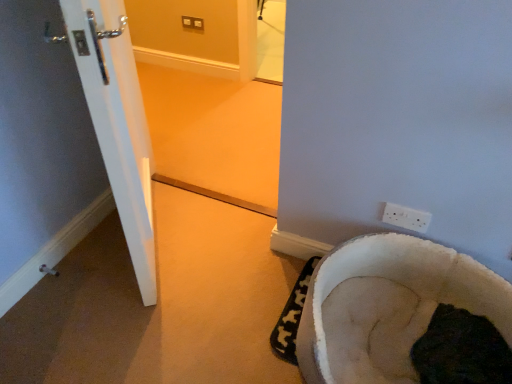
Describe the element at coordinates (388, 306) in the screenshot. I see `white fluffy pet bed at lower right` at that location.

Find the location of a particular element. white fluffy pet bed at lower right is located at coordinates (388, 306).

Measure the distance between dark fur bed at lower right and camera.

dark fur bed at lower right is 1.24 meters away from camera.

Where is `white fluffy pet bed at lower right`? white fluffy pet bed at lower right is located at coordinates (388, 306).

Does white plastic electric outlet at lower right have a lesser width compared to white fluffy pet bed at lower right?

Indeed, white plastic electric outlet at lower right has a lesser width compared to white fluffy pet bed at lower right.

Does white plastic electric outlet at lower right touch white fluffy pet bed at lower right?

There is a gap between white plastic electric outlet at lower right and white fluffy pet bed at lower right.

Who is shorter, white plastic electric outlet at lower right or white fluffy pet bed at lower right?

white fluffy pet bed at lower right is shorter.

Considering the sizes of objects white fluffy pet bed at lower right and white plastic electric outlet at lower right in the image provided, who is wider, white fluffy pet bed at lower right or white plastic electric outlet at lower right?

With larger width is white fluffy pet bed at lower right.

Does point (341, 321) appear closer or farther from the camera than point (402, 217)?

Point (341, 321) appears to be closer to the viewer than point (402, 217).

Where is `furniture below the white plastic electric outlet at lower right (from a real-world perspective)`? furniture below the white plastic electric outlet at lower right (from a real-world perspective) is located at coordinates (388, 306).

Can you tell me how much white fluffy pet bed at lower right and white plastic electric outlet at lower right differ in facing direction?

The angular difference between white fluffy pet bed at lower right and white plastic electric outlet at lower right is 179 degrees.

Which is behind, dark fur bed at lower right or white glossy door at lower left?

Positioned behind is white glossy door at lower left.

Looking at this image, is dark fur bed at lower right far from white glossy door at lower left?

Indeed, dark fur bed at lower right is not near white glossy door at lower left.

Between point (473, 351) and point (27, 274), which one is positioned in front?

The point (473, 351) is more forward.

From the picture: Considering the sizes of white fluffy pet bed at lower right and white glossy door at lower left in the image, is white fluffy pet bed at lower right wider or thinner than white glossy door at lower left?

Considering their sizes, white fluffy pet bed at lower right looks slimmer than white glossy door at lower left.

Find the location of a particular element. This screenshot has height=384, width=512. furniture above the white glossy door at lower left (from a real-world perspective) is located at coordinates point(388,306).

Do you think white fluffy pet bed at lower right is within white glossy door at lower left, or outside of it?

white fluffy pet bed at lower right is not inside white glossy door at lower left, it's outside.

How different are the orientations of white fluffy pet bed at lower right and white glossy door at lower left in degrees?

0.1 degrees.

Are white glossy door at lower left and white fluffy pet bed at lower right beside each other?

No, white glossy door at lower left is not touching white fluffy pet bed at lower right.

Is white glossy door at lower left oriented towards white fluffy pet bed at lower right?

No, white glossy door at lower left is not oriented towards white fluffy pet bed at lower right.

From the picture: From the image's perspective, is white glossy door at lower left located above or below white fluffy pet bed at lower right?

From the image's perspective, white glossy door at lower left appears above white fluffy pet bed at lower right.

In terms of width, does white glossy door at lower left look wider or thinner when compared to white fluffy pet bed at lower right?

Considering their sizes, white glossy door at lower left looks broader than white fluffy pet bed at lower right.

Could you tell me if dark fur bed at lower right is facing white fluffy pet bed at lower right?

No, dark fur bed at lower right is not facing towards white fluffy pet bed at lower right.

Considering the relative sizes of dark fur bed at lower right and white fluffy pet bed at lower right in the image provided, is dark fur bed at lower right thinner than white fluffy pet bed at lower right?

Yes.

From the image's perspective, which is above, dark fur bed at lower right or white fluffy pet bed at lower right?

white fluffy pet bed at lower right appears higher in the image.

What's the angular difference between white glossy door at lower left and white plastic electric outlet at lower right's facing directions?

The facing directions of white glossy door at lower left and white plastic electric outlet at lower right are 180 degrees apart.

From the image's perspective, relative to white plastic electric outlet at lower right, is white glossy door at lower left above or below?

Clearly, from the image's perspective, white glossy door at lower left is above white plastic electric outlet at lower right.

Is white glossy door at lower left in front of white plastic electric outlet at lower right?

No, white glossy door at lower left is further to the viewer.

Locate an element on the screen. electric outlet above the white fluffy pet bed at lower right (from a real-world perspective) is located at coordinates (406, 217).

Find the location of a particular element. The width and height of the screenshot is (512, 384). electric outlet lying above the white fluffy pet bed at lower right (from the image's perspective) is located at coordinates (406, 217).

Looking at the image, which one is located further to white plastic electric outlet at lower right, white glossy door at lower left or white fluffy pet bed at lower right?

white glossy door at lower left is positioned further to the anchor white plastic electric outlet at lower right.

When comparing their distances from white plastic electric outlet at lower right, does white fluffy pet bed at lower right or white glossy door at lower left seem further?

Among the two, white glossy door at lower left is located further to white plastic electric outlet at lower right.

Considering their positions, is white plastic electric outlet at lower right positioned closer to dark fur bed at lower right than white fluffy pet bed at lower right?

Based on the image, white fluffy pet bed at lower right appears to be nearer to dark fur bed at lower right.

Which object lies further to the anchor point white glossy door at lower left, dark fur bed at lower right or white fluffy pet bed at lower right?

dark fur bed at lower right.

Which object lies further to the anchor point white glossy door at lower left, white plastic electric outlet at lower right or dark fur bed at lower right?

dark fur bed at lower right.

Based on their spatial positions, is white glossy door at lower left or dark fur bed at lower right closer to white plastic electric outlet at lower right?

The object closer to white plastic electric outlet at lower right is dark fur bed at lower right.

Looking at the image, which one is located further to white plastic electric outlet at lower right, dark fur bed at lower right or white fluffy pet bed at lower right?

Among the two, dark fur bed at lower right is located further to white plastic electric outlet at lower right.

When comparing their distances from white fluffy pet bed at lower right, does dark fur bed at lower right or white plastic electric outlet at lower right seem further?

The object further to white fluffy pet bed at lower right is white plastic electric outlet at lower right.

Identify the location of furniture between white plastic electric outlet at lower right and dark fur bed at lower right in the vertical direction. 388,306.

Where is `electric outlet between white glossy door at lower left and dark fur bed at lower right`? The image size is (512, 384). electric outlet between white glossy door at lower left and dark fur bed at lower right is located at coordinates (406, 217).

Find the location of a particular element. furniture between white glossy door at lower left and dark fur bed at lower right in the horizontal direction is located at coordinates (388, 306).

Where is `furniture between white glossy door at lower left and white plastic electric outlet at lower right from left to right`? furniture between white glossy door at lower left and white plastic electric outlet at lower right from left to right is located at coordinates (388, 306).